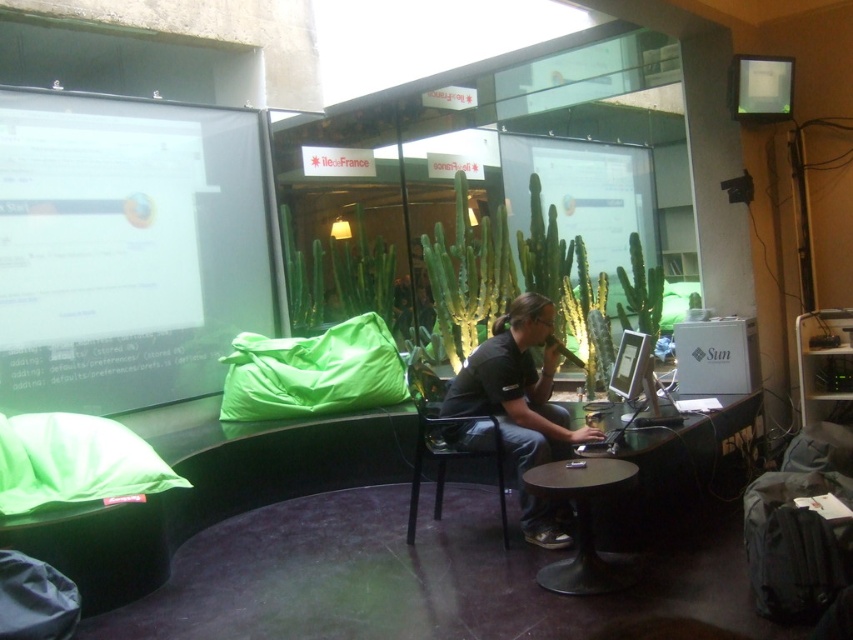
Identify the location of metallic round table at center. Image resolution: width=853 pixels, height=640 pixels. (584, 524).

Is point (589, 477) closer to viewer compared to point (784, 116)?

Yes.

You are a GUI agent. You are given a task and a screenshot of the screen. Output one action in this format:
    pyautogui.click(x=<x>, y=<y>)
    Task: Click on the metallic round table at center
    This screenshot has width=853, height=640.
    Given the screenshot: What is the action you would take?
    pyautogui.click(x=584, y=524)

Is black matte shirt at center closer to the viewer compared to matte white monitor at upper right?

Yes.

The height and width of the screenshot is (640, 853). Identify the location of black matte shirt at center. pos(521,406).

Does black matte shirt at center have a greater height compared to metallic round table at center?

Yes, black matte shirt at center is taller than metallic round table at center.

Between black matte shirt at center and metallic round table at center, which one has more height?

black matte shirt at center is taller.

I want to click on black matte shirt at center, so click(521, 406).

Where is `black matte shirt at center`? This screenshot has height=640, width=853. black matte shirt at center is located at coordinates pos(521,406).